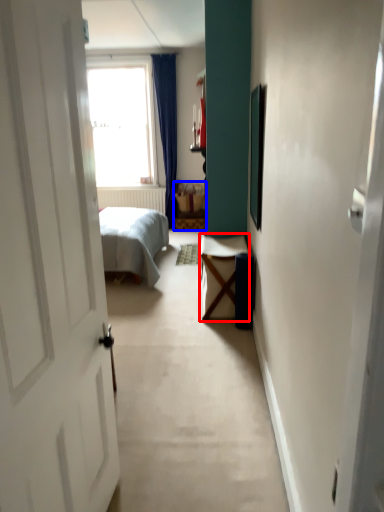
Question: Among these objects, which one is nearest to the camera, table (highlighted by a red box) or furniture (highlighted by a blue box)?

Choices:
 (A) table
 (B) furniture

Answer: (A)